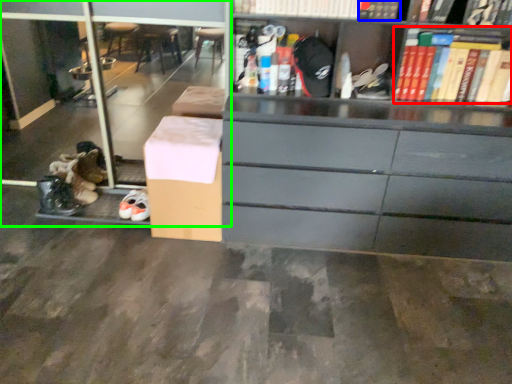
Question: Which object is the farthest from book (highlighted by a red box)? Choose among these: book (highlighted by a blue box) or shelf (highlighted by a green box).

Choices:
 (A) book
 (B) shelf

Answer: (B)